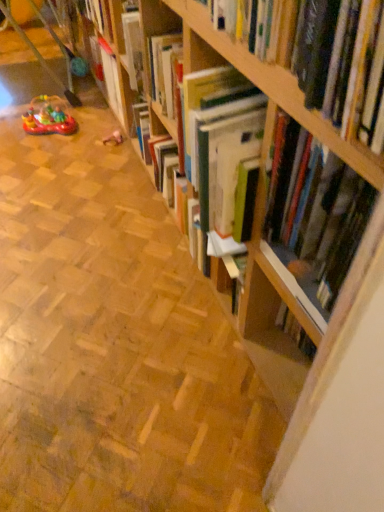
Locate an element on the screen. The height and width of the screenshot is (512, 384). vacant space in front of rubber boat at left, acting as the first toy starting from the left is located at coordinates click(x=45, y=155).